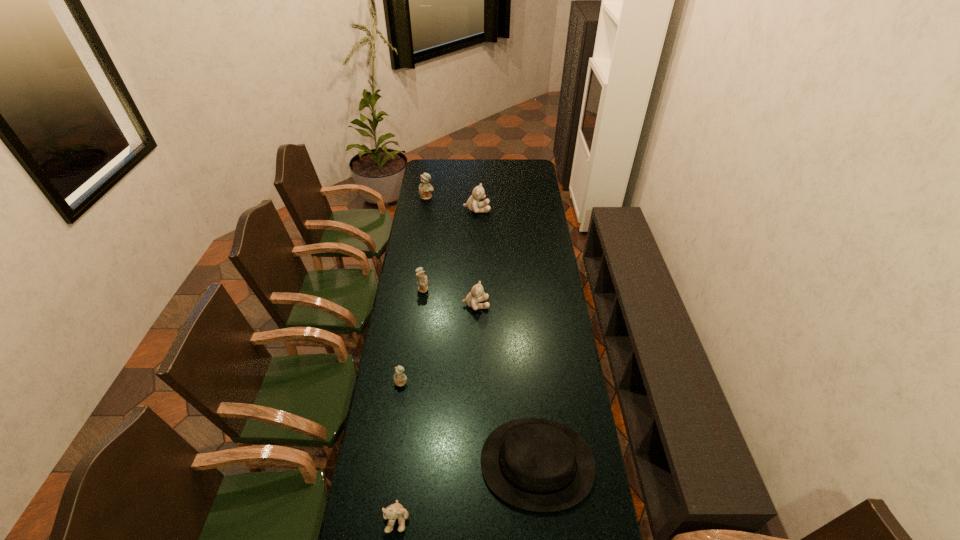
Where is `free region that satisfies the following two spatial constraints: 1. on the front-facing side of the second biggest blue teddy bear; 2. on the back side of the black fedora`? This screenshot has width=960, height=540. free region that satisfies the following two spatial constraints: 1. on the front-facing side of the second biggest blue teddy bear; 2. on the back side of the black fedora is located at coordinates (400, 463).

The image size is (960, 540). Identify the location of vacant space that satisfies the following two spatial constraints: 1. on the face of the fifth nearest teddy bear; 2. on the face of the nearest gray teddy bear. (474, 518).

This screenshot has height=540, width=960. Find the location of `free location that satisfies the following two spatial constraints: 1. on the front-facing side of the fedora; 2. on the right side of the fifth farthest teddy bear`. free location that satisfies the following two spatial constraints: 1. on the front-facing side of the fedora; 2. on the right side of the fifth farthest teddy bear is located at coordinates (390, 463).